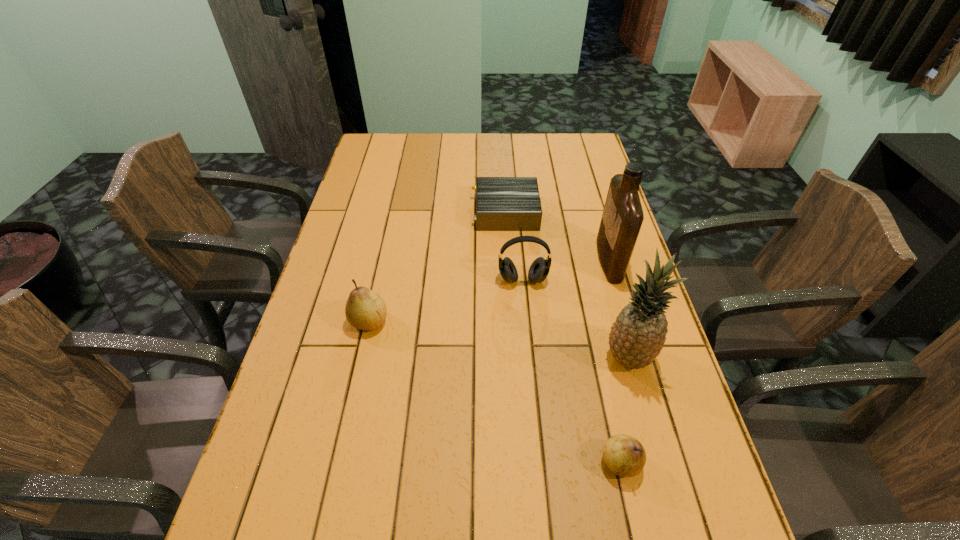
At what (x,y) coordinates should I click in order to perform the action: click on free space at the far right corner. Please return your answer as a coordinate pair (x, y). The height and width of the screenshot is (540, 960). Looking at the image, I should click on (570, 163).

Identify the location of unoccupied position between the liquor and the nearer pear. (614, 361).

Where is `vacant space in between the headset and the liquor`? vacant space in between the headset and the liquor is located at coordinates (566, 270).

At what (x,y) coordinates should I click in order to perform the action: click on free space between the liquor and the leftmost object. Please return your answer as a coordinate pair (x, y). Looking at the image, I should click on (490, 291).

Where is `vacant region between the nearer pear and the liquor`? The image size is (960, 540). vacant region between the nearer pear and the liquor is located at coordinates (614, 361).

In order to click on empty space that is in between the liquor and the left pear in this screenshot , I will do `click(490, 291)`.

I want to click on free spot between the headset and the second nearest object, so pyautogui.click(x=576, y=319).

The image size is (960, 540). I want to click on free space between the router and the right pear, so click(564, 337).

Locate an element on the screen. The image size is (960, 540). vacant region between the liquor and the router is located at coordinates (558, 236).

Locate an element on the screen. This screenshot has height=540, width=960. free space between the liquor and the headset is located at coordinates (566, 270).